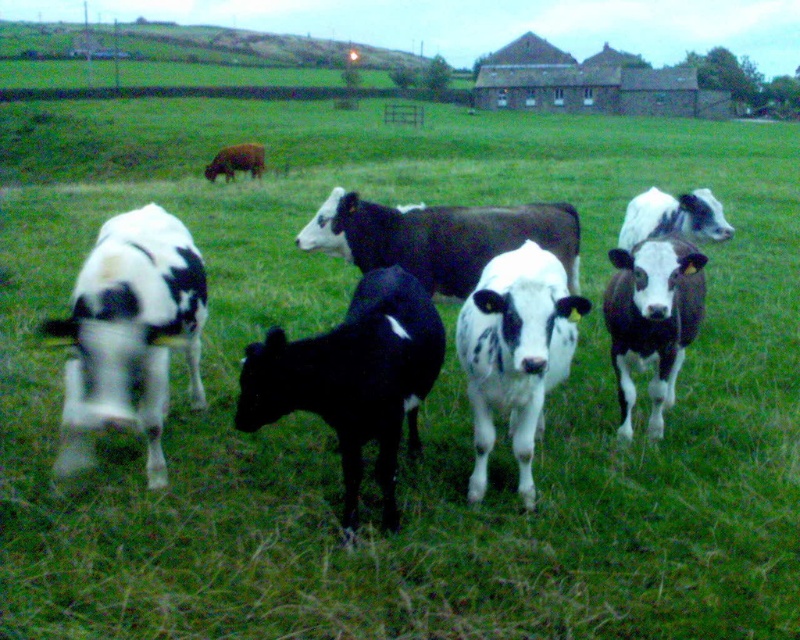
Question: Can you confirm if black and white cows at center is positioned to the left of black smooth calf at center?

Choices:
 (A) yes
 (B) no

Answer: (B)

Question: Which point is farther to the camera?

Choices:
 (A) (382, 396)
 (B) (352, 458)

Answer: (B)

Question: Can you confirm if black and white cows at center is positioned below black smooth calf at center?

Choices:
 (A) yes
 (B) no

Answer: (B)

Question: Which point is farther to the camera?

Choices:
 (A) (389, 273)
 (B) (432, 234)

Answer: (B)

Question: Where is black and white cows at center located in relation to black smooth calf at center in the image?

Choices:
 (A) left
 (B) right

Answer: (B)

Question: Which point appears closest to the camera in this image?

Choices:
 (A) coord(150,365)
 (B) coord(340,332)

Answer: (B)